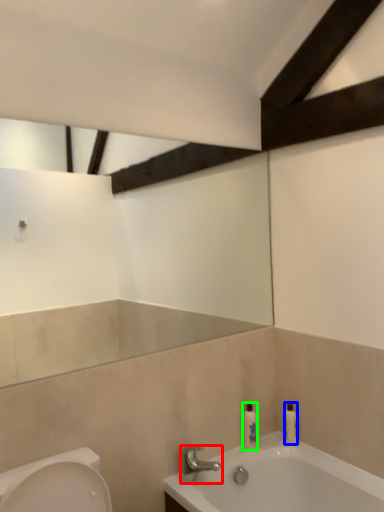
Question: Estimate the real-world distances between objects in this image. Which object is closer to tap (highlighted by a red box), toiletry (highlighted by a blue box) or toiletry (highlighted by a green box)?

Choices:
 (A) toiletry
 (B) toiletry

Answer: (B)